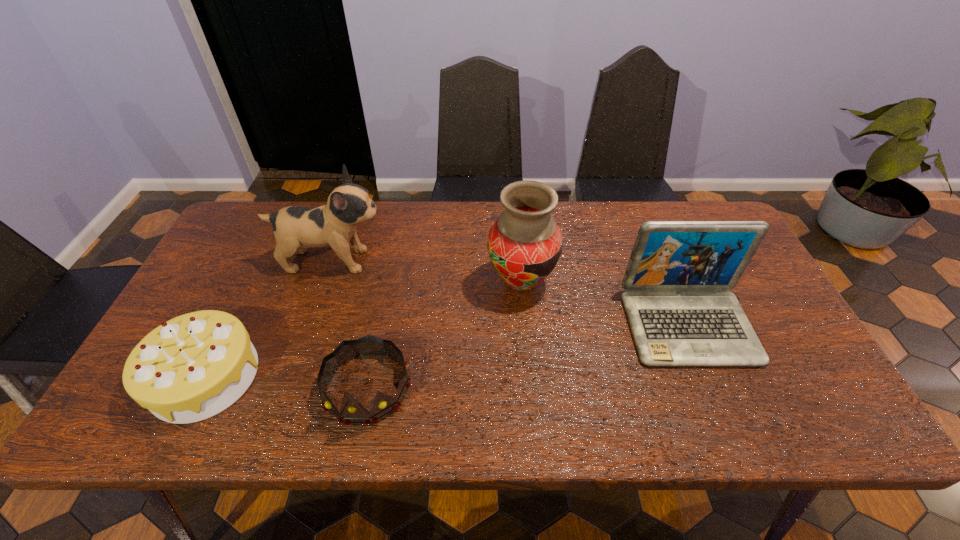
Find the location of a particular element. birthday cake present at the near edge is located at coordinates (192, 367).

At what (x,y) coordinates should I click in order to perform the action: click on tiara situated at the near edge. Please return your answer as a coordinate pair (x, y). The width and height of the screenshot is (960, 540). Looking at the image, I should click on (352, 412).

Find the location of a particular element. This screenshot has width=960, height=540. object located at the left edge is located at coordinates (192, 367).

The height and width of the screenshot is (540, 960). In order to click on object that is at the right edge in this screenshot , I will do `click(680, 312)`.

The image size is (960, 540). I want to click on object that is at the near left corner, so click(192, 367).

Find the location of `vacant space at the far edge of the desktop`. vacant space at the far edge of the desktop is located at coordinates (473, 242).

At what (x,y) coordinates should I click in order to perform the action: click on vacant area at the near edge. Please return your answer as a coordinate pair (x, y). Looking at the image, I should click on (371, 427).

Locate an element on the screen. The image size is (960, 540). free space at the far right corner of the desktop is located at coordinates (712, 211).

In the image, there is a desktop. In order to click on vacant space at the near right corner in this screenshot , I will do `click(804, 400)`.

Where is `free space between the birthday cake and the laptop computer`? The width and height of the screenshot is (960, 540). free space between the birthday cake and the laptop computer is located at coordinates (446, 351).